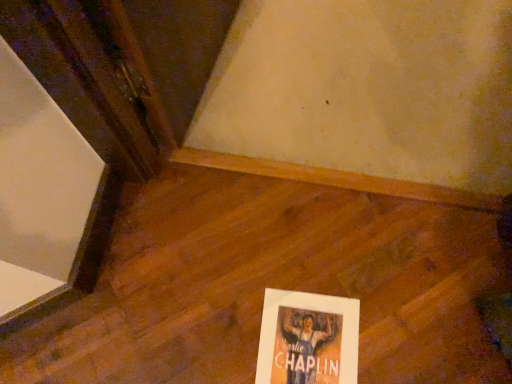
Question: Is wooden floor at center in front of or behind matte paper poster at lower right in the image?

Choices:
 (A) front
 (B) behind

Answer: (A)

Question: Considering the positions of wooden floor at center and matte paper poster at lower right in the image, is wooden floor at center taller or shorter than matte paper poster at lower right?

Choices:
 (A) short
 (B) tall

Answer: (B)

Question: Which is correct: wooden floor at center is inside matte paper poster at lower right, or outside of it?

Choices:
 (A) outside
 (B) inside

Answer: (A)

Question: Is point (308, 327) closer or farther from the camera than point (271, 220)?

Choices:
 (A) farther
 (B) closer

Answer: (B)

Question: From a real-world perspective, is matte paper poster at lower right above or below wooden floor at center?

Choices:
 (A) below
 (B) above

Answer: (A)

Question: In the image, is matte paper poster at lower right on the left side or the right side of wooden floor at center?

Choices:
 (A) left
 (B) right

Answer: (B)

Question: In terms of width, does matte paper poster at lower right look wider or thinner when compared to wooden floor at center?

Choices:
 (A) wide
 (B) thin

Answer: (B)